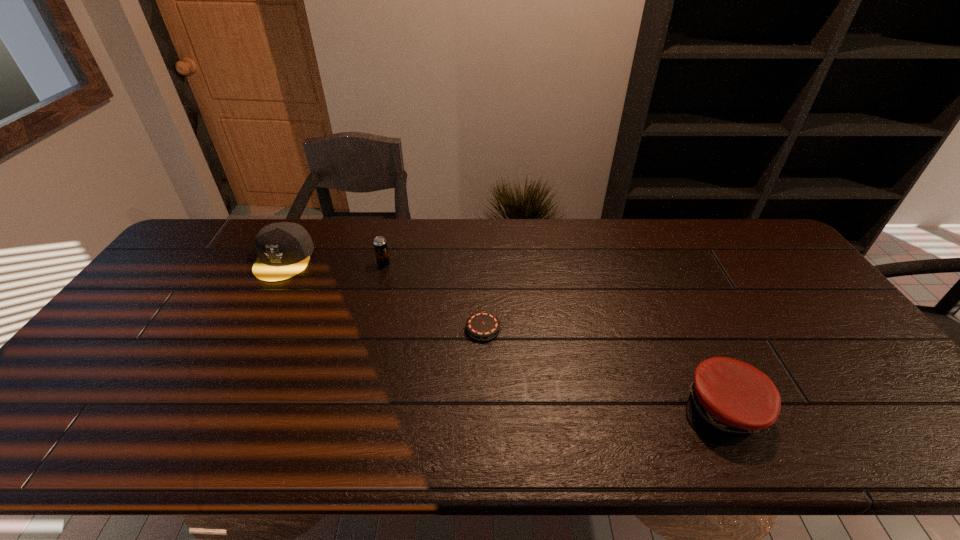
Where is `cap that is at the far edge`? The image size is (960, 540). cap that is at the far edge is located at coordinates (284, 248).

The width and height of the screenshot is (960, 540). Find the location of `beer can positioned at the far edge`. beer can positioned at the far edge is located at coordinates (380, 244).

At what (x,y) coordinates should I click in order to perform the action: click on object that is at the near edge. Please return your answer as a coordinate pair (x, y). The height and width of the screenshot is (540, 960). Looking at the image, I should click on (729, 400).

In order to click on vacant space at the far edge of the desktop in this screenshot , I will do `click(461, 231)`.

Image resolution: width=960 pixels, height=540 pixels. Identify the location of vacant region at the near edge of the desktop. (747, 450).

In the image, there is a desktop. At what (x,y) coordinates should I click in order to perform the action: click on vacant space at the left edge. Please return your answer as a coordinate pair (x, y). Looking at the image, I should click on (140, 355).

Where is `vacant space at the right edge`? vacant space at the right edge is located at coordinates (801, 279).

Where is `vacant space at the far left corner of the desktop`? The height and width of the screenshot is (540, 960). vacant space at the far left corner of the desktop is located at coordinates (220, 231).

At what (x,y) coordinates should I click in order to perform the action: click on free space at the far right corner. Please return your answer as a coordinate pair (x, y). This screenshot has height=540, width=960. Looking at the image, I should click on (718, 223).

At what (x,y) coordinates should I click in order to perform the action: click on free spot between the left cap and the second nearest object. Please return your answer as a coordinate pair (x, y). Image resolution: width=960 pixels, height=540 pixels. Looking at the image, I should click on (383, 294).